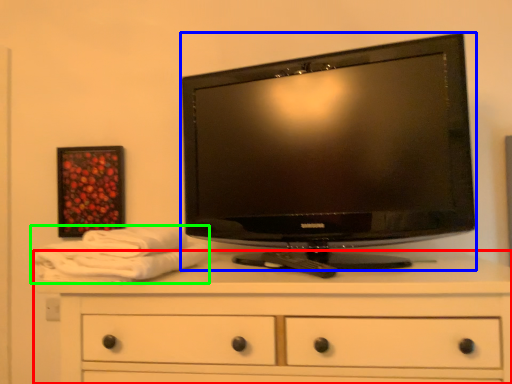
Question: Considering the real-world distances, which object is closest to chest of drawers (highlighted by a red box)? television (highlighted by a blue box) or bath towel (highlighted by a green box).

Choices:
 (A) television
 (B) bath towel

Answer: (B)